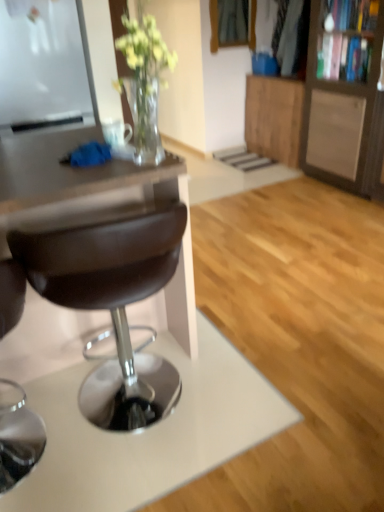
Question: From the image's perspective, is wooden cabinet at right, which appears as the 2th cabinetry when viewed from the back, above or below brown leather stool at center?

Choices:
 (A) below
 (B) above

Answer: (B)

Question: Considering the relative positions of wooden cabinet at right, which appears as the 2th cabinetry when viewed from the back, and brown leather stool at center in the image provided, is wooden cabinet at right, which appears as the 2th cabinetry when viewed from the back, to the left or to the right of brown leather stool at center?

Choices:
 (A) right
 (B) left

Answer: (A)

Question: Which of these objects is positioned farthest from the brown leather stool at center?

Choices:
 (A) wooden cabinet at upper right, placed as the second cabinetry when sorted from front to back
 (B) wooden cabinet at right, arranged as the 1th cabinetry when viewed from the front
 (C) brown leather desk at left

Answer: (A)

Question: Considering the real-world distances, which object is closest to the wooden cabinet at upper right, positioned as the 1th cabinetry in back-to-front order?

Choices:
 (A) brown leather stool at center
 (B) brown leather desk at left
 (C) wooden cabinet at right, arranged as the 1th cabinetry when viewed from the front

Answer: (C)